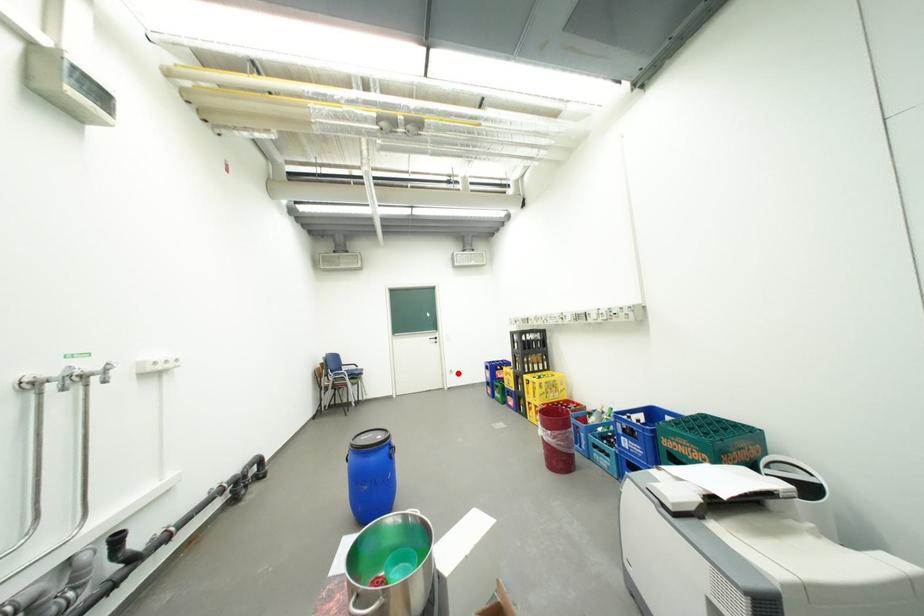
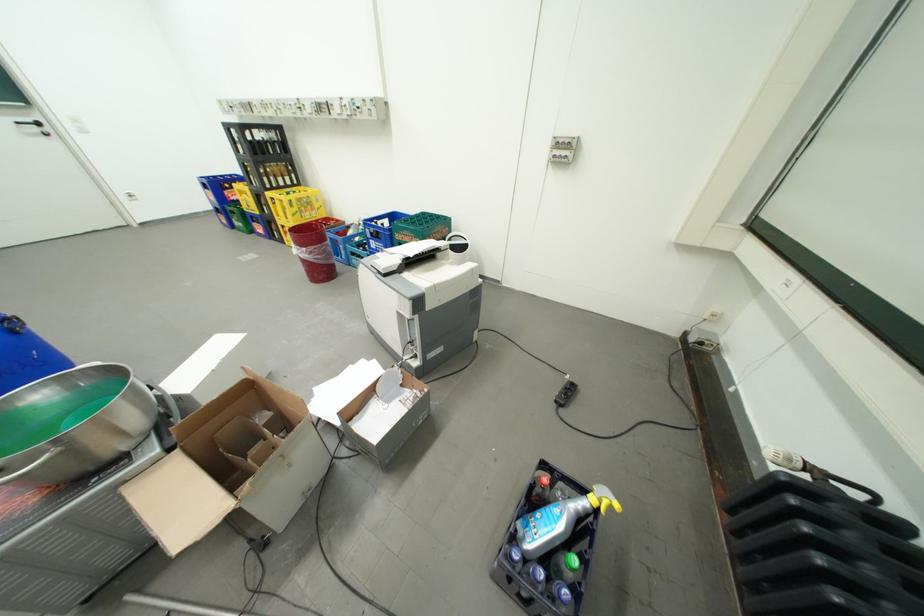
In the second image, find the point that corresponds to the highlighted location in the first image.

(134, 199)